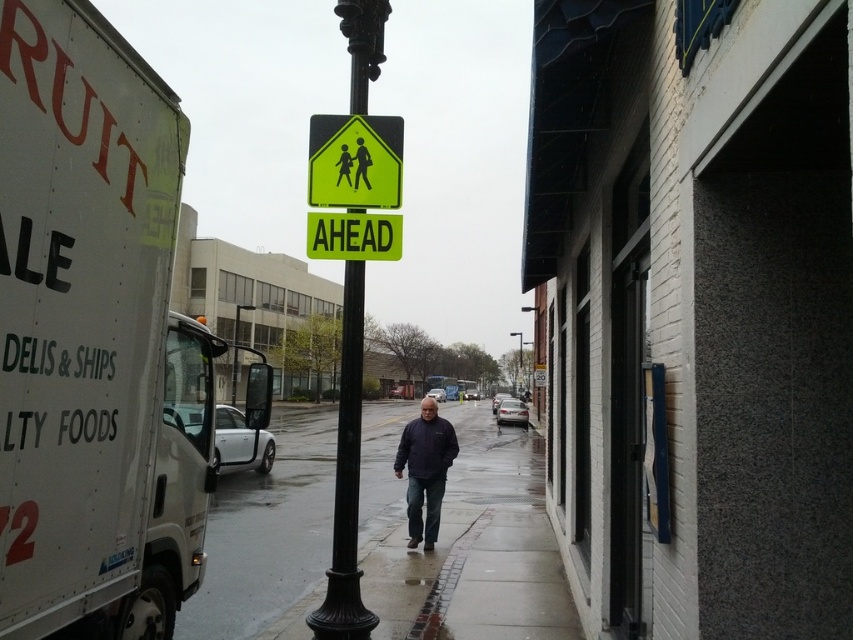
Can you confirm if dark blue jacket at center is shorter than yellow reflective pedestrian sign at center?

No.

Does dark blue jacket at center have a greater width compared to yellow reflective pedestrian sign at center?

Yes, dark blue jacket at center is wider than yellow reflective pedestrian sign at center.

Does point (432, 497) come in front of point (360, 148)?

No, it is not.

The image size is (853, 640). I want to click on dark blue jacket at center, so click(x=425, y=468).

Does yellow reflective plastic pedestrian crossing sign at center have a larger size compared to green matte pedestrian crossing sign at center?

Yes.

Is point (357, 202) behind point (387, 243)?

That is False.

Does point (335, 192) lie in front of point (363, 248)?

No, (335, 192) is further to viewer.

Where is `yellow reflective plastic pedestrian crossing sign at center`? yellow reflective plastic pedestrian crossing sign at center is located at coordinates (354, 161).

Based on the photo, who is more distant from viewer, [415,541] or [352,220]?

Point [415,541]

Between point (436, 428) and point (312, 214), which one is positioned behind?

The point (436, 428) is behind.

Find the location of a particular element. This screenshot has width=853, height=640. dark blue jacket at center is located at coordinates (425, 468).